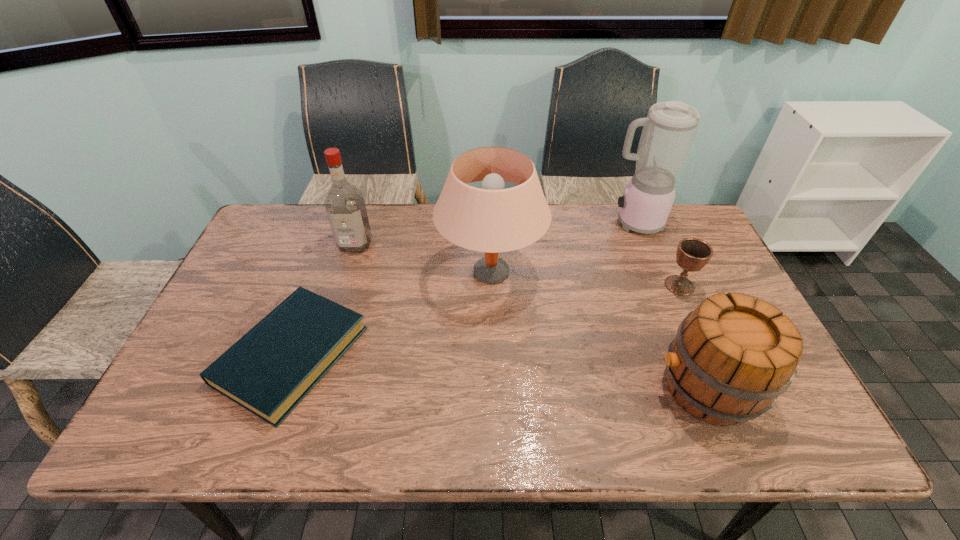
Locate an element on the screen. vacant space at the far edge of the desktop is located at coordinates (558, 227).

In the image, there is a desktop. Where is `free space at the left edge`? This screenshot has width=960, height=540. free space at the left edge is located at coordinates tap(273, 289).

In the image, there is a desktop. Where is `vacant space at the far left corner`? Image resolution: width=960 pixels, height=540 pixels. vacant space at the far left corner is located at coordinates (287, 217).

The width and height of the screenshot is (960, 540). I want to click on vacant space at the far right corner, so point(683,220).

In order to click on empty space between the fourth tallest object and the third object from left to right in this screenshot , I will do `click(598, 330)`.

Identify the location of vacant space that is in between the lampshade and the shortest object. (392, 314).

Find the location of a particular element. vacant space in between the lampshade and the chalice is located at coordinates (585, 279).

In order to click on free space between the shortest object and the chalice in this screenshot , I will do `click(486, 320)`.

Where is `vacant region between the fourth tallest object and the book`? vacant region between the fourth tallest object and the book is located at coordinates (499, 372).

The image size is (960, 540). I want to click on empty space between the liquor and the cider, so [531, 316].